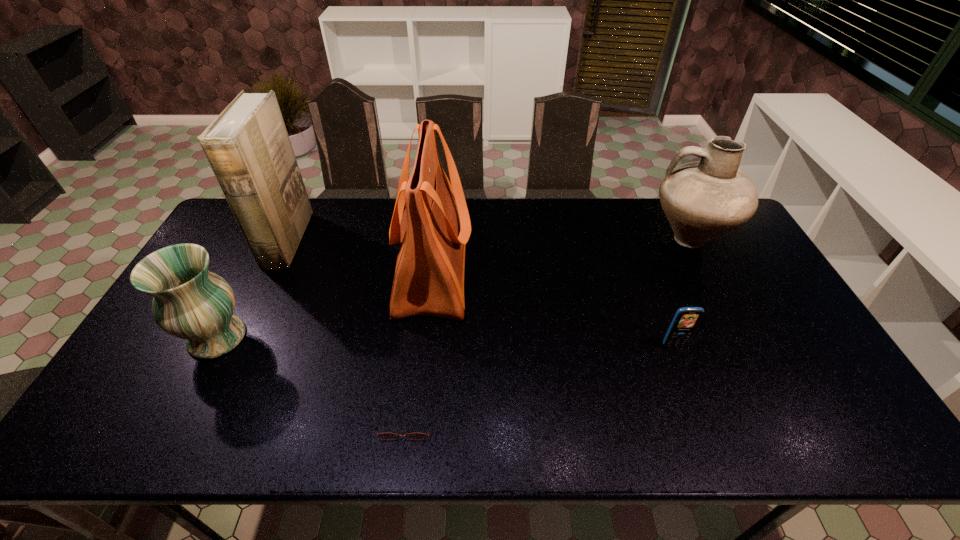
You are a GUI agent. You are given a task and a screenshot of the screen. Output one action in this format:
    pyautogui.click(x=<x>, y=<y>)
    Task: Click on the empty space between the vase and the second shortest object
    The height and width of the screenshot is (540, 960).
    Given the screenshot: What is the action you would take?
    pyautogui.click(x=445, y=341)

I want to click on vacant area that lies between the rightmost object and the phonebook, so point(488,240).

You are a GUI agent. You are given a task and a screenshot of the screen. Output one action in this format:
    pyautogui.click(x=<x>, y=<y>)
    Task: Click on the empty location between the vase and the phonebook
    The width and height of the screenshot is (960, 540).
    Given the screenshot: What is the action you would take?
    pyautogui.click(x=252, y=289)

Find the location of a particular element. The height and width of the screenshot is (540, 960). free space between the sunglasses and the fourth tallest object is located at coordinates (311, 380).

This screenshot has height=540, width=960. I want to click on free spot between the cellular telephone and the third shortest object, so click(445, 341).

This screenshot has height=540, width=960. Find the location of `vacant space that is in between the fourth shortest object and the sunglasses`. vacant space that is in between the fourth shortest object and the sunglasses is located at coordinates (547, 330).

At what (x,y) coordinates should I click in order to perform the action: click on free space between the nearest object and the phonebook. Please return your answer as a coordinate pair (x, y). Looking at the image, I should click on (347, 332).

You are a GUI agent. You are given a task and a screenshot of the screen. Output one action in this format:
    pyautogui.click(x=<x>, y=<y>)
    Task: Click on the object identified as the fourth closest to the fifth object from left to right
    This screenshot has height=540, width=960.
    Given the screenshot: What is the action you would take?
    pyautogui.click(x=190, y=302)

Locate which object ranks fifth in proximity to the phonebook. Please provide its 2D coordinates. Your answer should be formatted as a tuple, i.e. [(x, y)], where the tuple contains the x and y coordinates of a point satisfying the conditions above.

[(702, 200)]